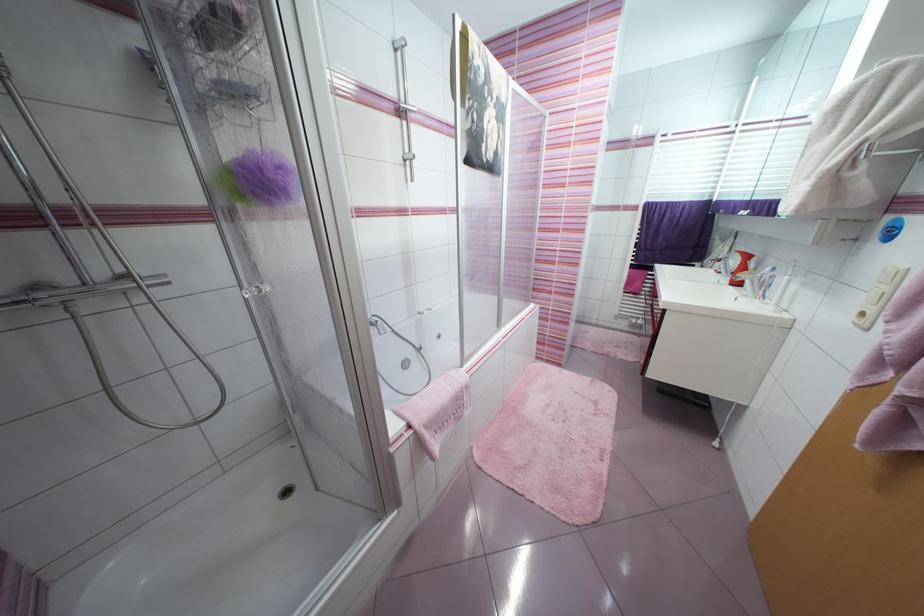
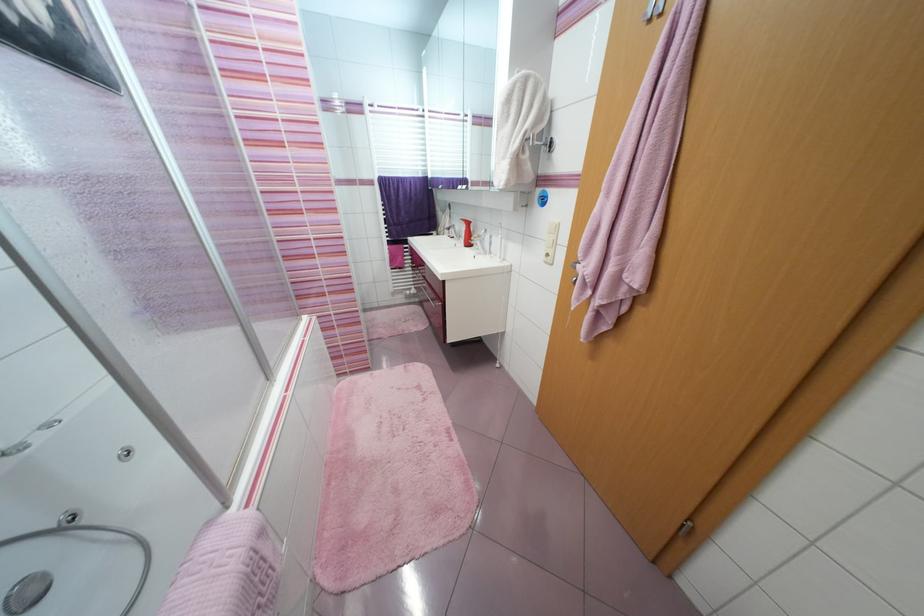
Question: The first image is from the beginning of the video and the second image is from the end. How did the camera likely rotate when shooting the video?

Choices:
 (A) Left
 (B) Right
 (C) Up
 (D) Down

Answer: (B)